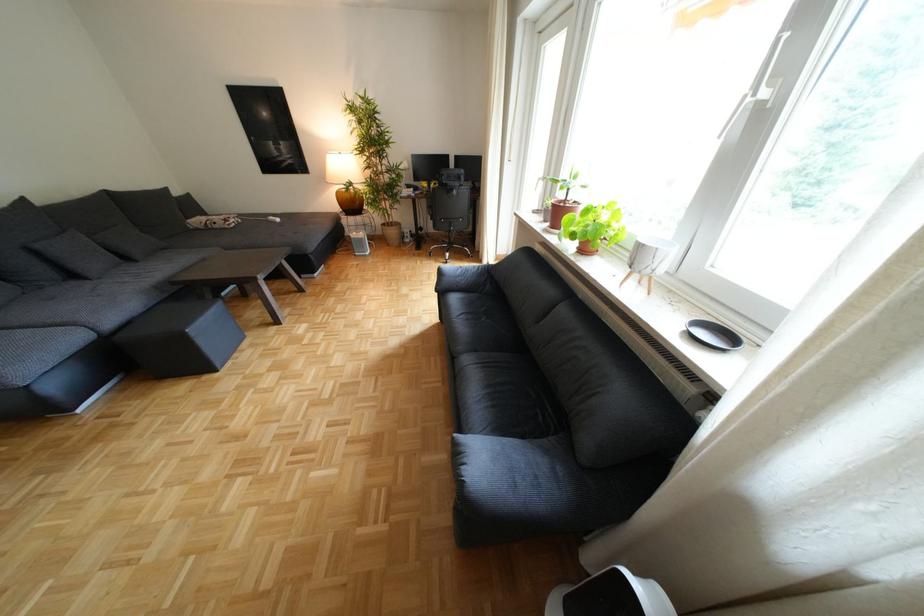
Where is `white marble pot`? The image size is (924, 616). white marble pot is located at coordinates (610, 596).